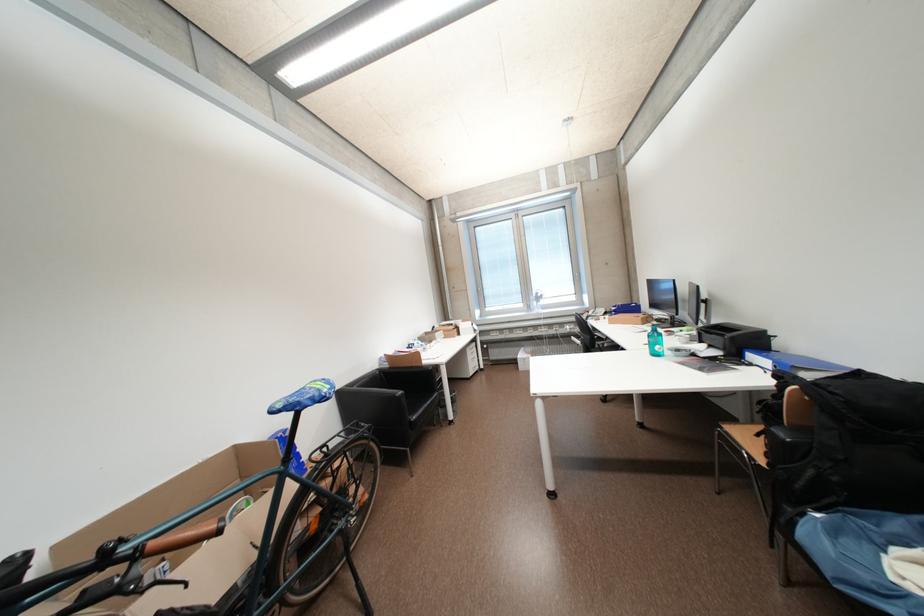
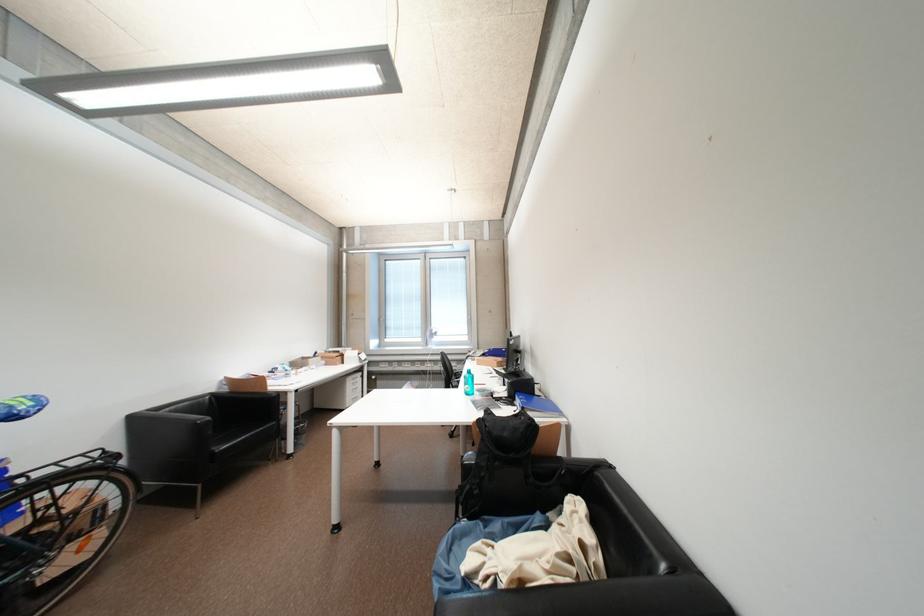
In the second image, find the point that corresponds to [421,367] in the first image.

(264, 392)